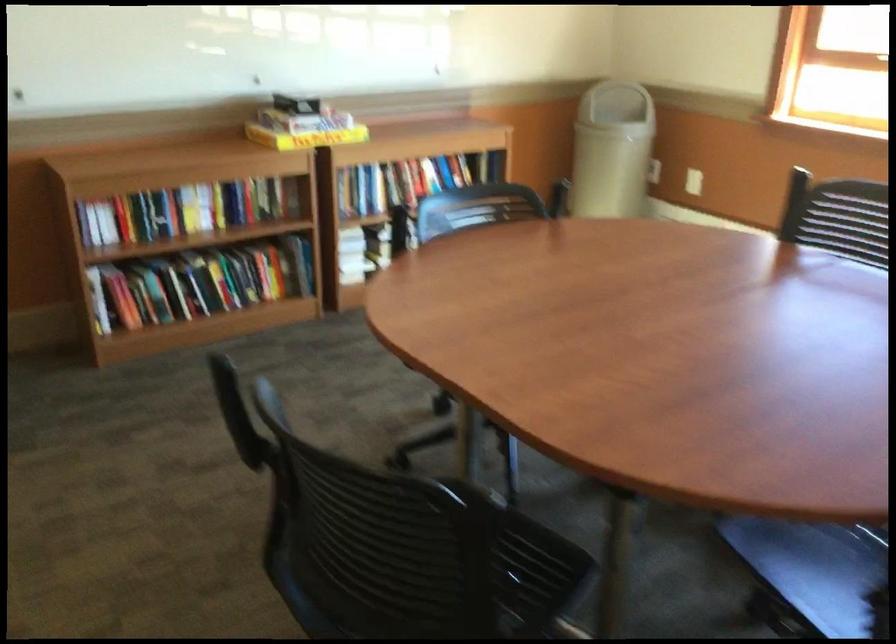
Question: The first image is from the beginning of the video and the second image is from the end. How did the camera likely rotate when shooting the video?

Choices:
 (A) Left
 (B) Right
 (C) Up
 (D) Down

Answer: (B)